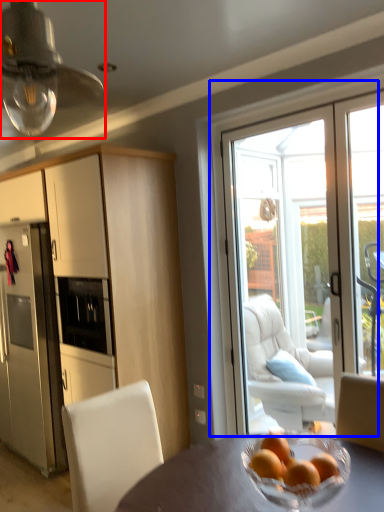
Question: Among these objects, which one is farthest to the camera, light fixture (highlighted by a red box) or door (highlighted by a blue box)?

Choices:
 (A) light fixture
 (B) door

Answer: (B)